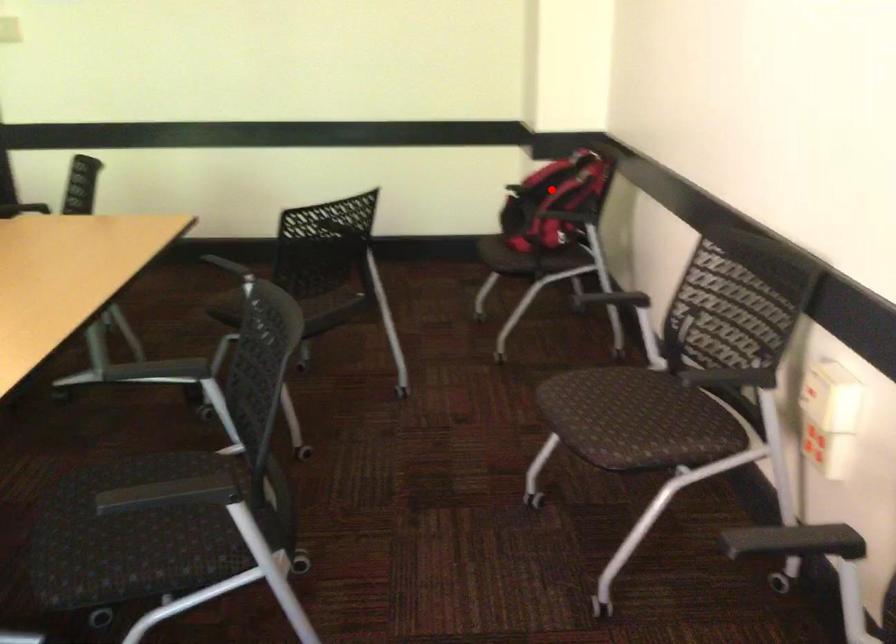
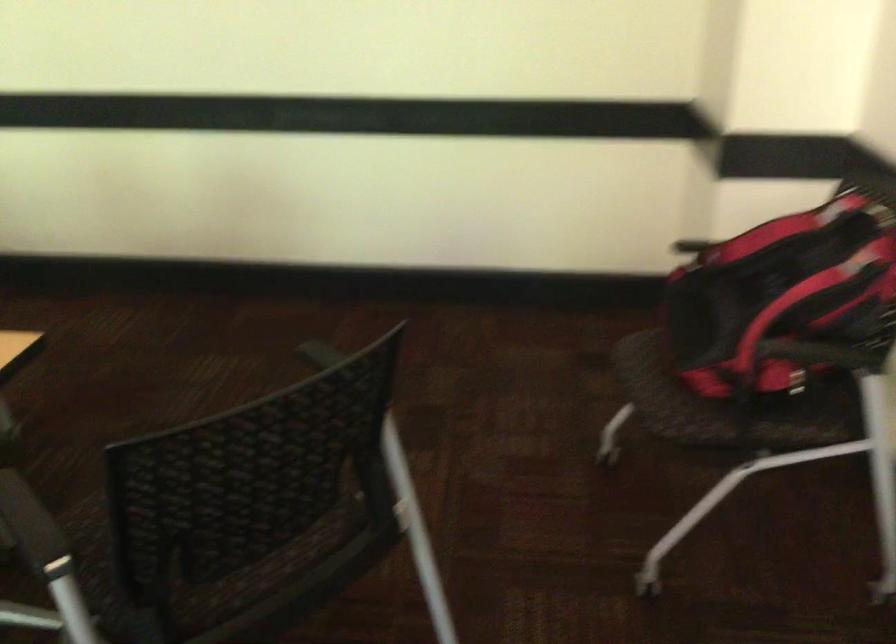
Question: I am providing you with two images of the same scene from different viewpoints. Image1 has a red point marked. In image2, the corresponding 3D location appears at what relative position? Reply with the corresponding letter.

Choices:
 (A) Closer
 (B) Farther

Answer: (A)